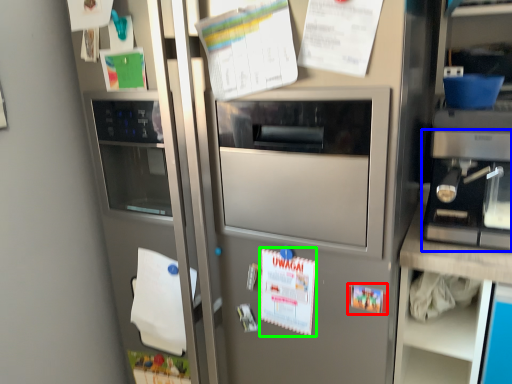
Question: Estimate the real-world distances between objects in this image. Which object is farther from poster (highlighted by a red box), appliance (highlighted by a blue box) or poster (highlighted by a green box)?

Choices:
 (A) appliance
 (B) poster

Answer: (A)